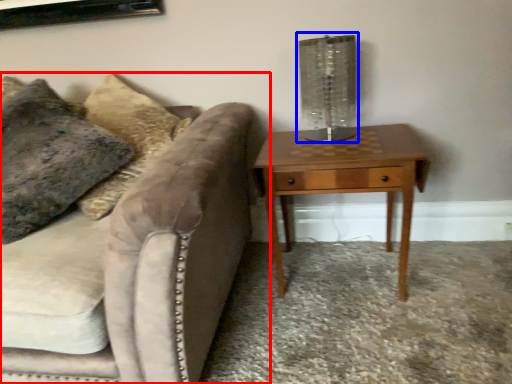
Question: Which point is further to the camera, studio couch (highlighted by a red box) or table lamp (highlighted by a blue box)?

Choices:
 (A) studio couch
 (B) table lamp

Answer: (B)